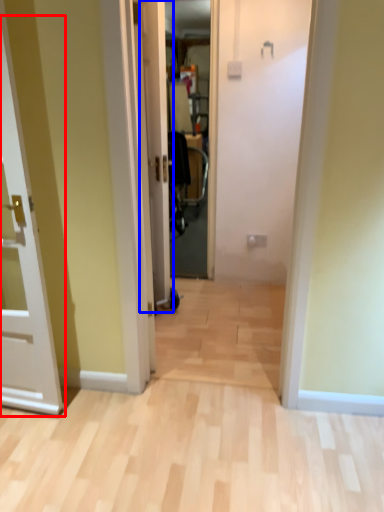
Question: Among these objects, which one is nearest to the camera, door (highlighted by a red box) or door (highlighted by a blue box)?

Choices:
 (A) door
 (B) door

Answer: (A)